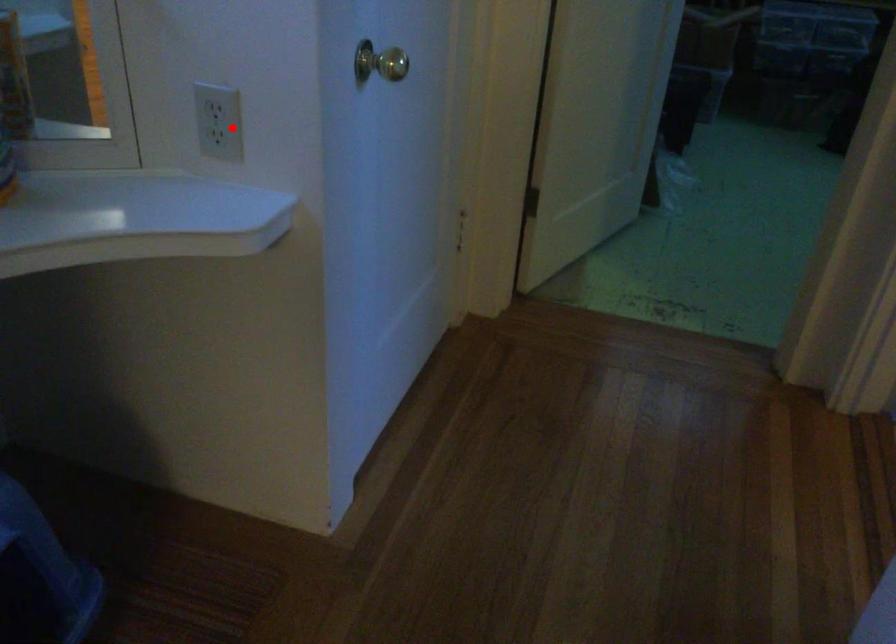
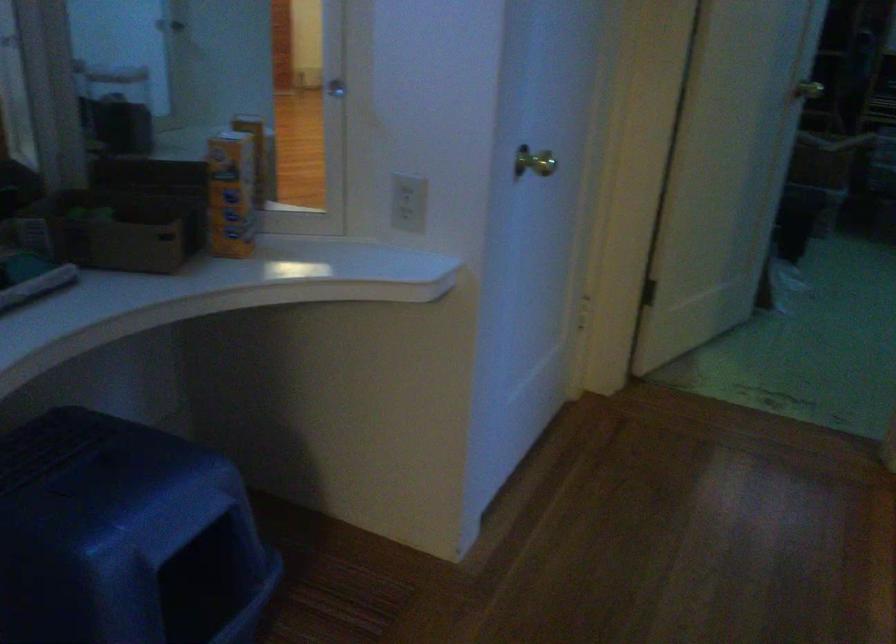
Find the pixel in the second image that matches the highlighted location in the first image.

(409, 202)